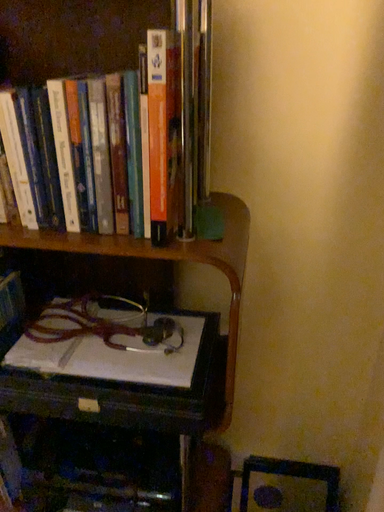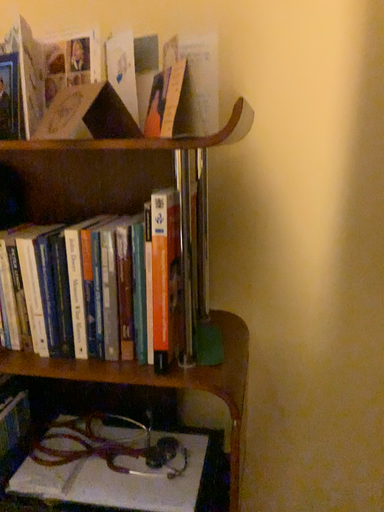
Question: Which way did the camera rotate in the video?

Choices:
 (A) rotated downward
 (B) rotated upward

Answer: (B)